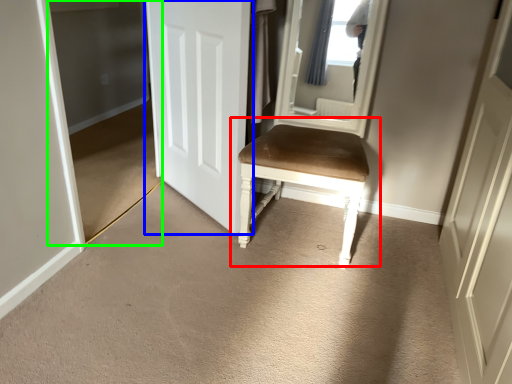
Question: Based on their relative distances, which object is farther from chair (highlighted by a red box)? Choose from door (highlighted by a blue box) and glass door (highlighted by a green box).

Choices:
 (A) door
 (B) glass door

Answer: (B)